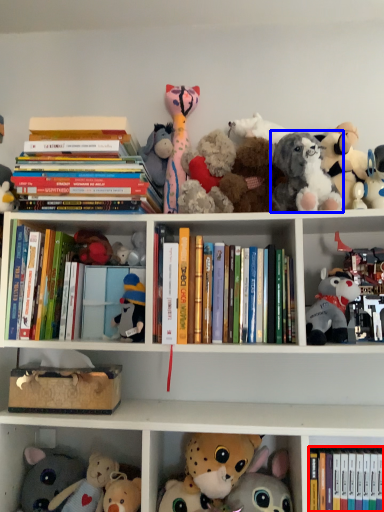
Question: Which of the following is the farthest to the observer, book (highlighted by a red box) or toy (highlighted by a blue box)?

Choices:
 (A) book
 (B) toy

Answer: (B)